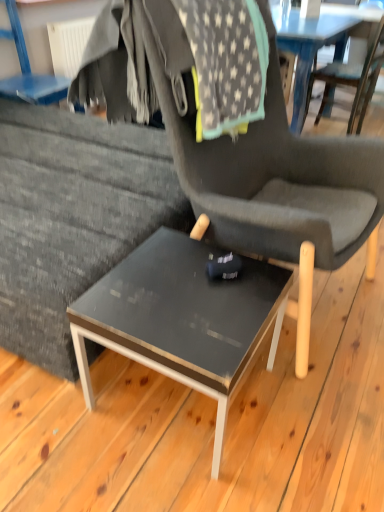
Question: From the image's perspective, is wooden chair at center, which is the 3th chair in left-to-right order, on top of matte black table at center?

Choices:
 (A) no
 (B) yes

Answer: (B)

Question: From a real-world perspective, is wooden chair at center, arranged as the first chair when viewed from the right, physically above matte black table at center?

Choices:
 (A) no
 (B) yes

Answer: (B)

Question: Considering the relative sizes of wooden chair at center, arranged as the first chair when viewed from the right, and matte black table at center in the image provided, is wooden chair at center, arranged as the first chair when viewed from the right, smaller than matte black table at center?

Choices:
 (A) yes
 (B) no

Answer: (B)

Question: From the image's perspective, would you say wooden chair at center, arranged as the first chair when viewed from the right, is shown under matte black table at center?

Choices:
 (A) no
 (B) yes

Answer: (A)

Question: Can you confirm if wooden chair at center, which is the 3th chair in left-to-right order, is wider than matte black table at center?

Choices:
 (A) yes
 (B) no

Answer: (A)

Question: Is matte gray chair at upper left, arranged as the 1th chair when viewed from the left, inside or outside of matte black table at center?

Choices:
 (A) outside
 (B) inside

Answer: (A)

Question: From a real-world perspective, is matte gray chair at upper left, arranged as the third chair when viewed from the right, positioned above or below matte black table at center?

Choices:
 (A) below
 (B) above

Answer: (B)

Question: From the image's perspective, relative to matte black table at center, is matte gray chair at upper left, arranged as the 1th chair when viewed from the left, above or below?

Choices:
 (A) above
 (B) below

Answer: (A)

Question: Relative to matte black table at center, is matte gray chair at upper left, arranged as the 1th chair when viewed from the left, in front or behind?

Choices:
 (A) behind
 (B) front

Answer: (A)

Question: Would you say matte black chair at center, the 2th chair in the right-to-left sequence, is to the left or to the right of wooden chair at center, which is the 3th chair in left-to-right order, in the picture?

Choices:
 (A) right
 (B) left

Answer: (B)

Question: Looking at the image, does matte black chair at center, the 2th chair from the left, seem bigger or smaller compared to wooden chair at center, arranged as the first chair when viewed from the right?

Choices:
 (A) big
 (B) small

Answer: (A)

Question: Considering the positions of matte black chair at center, the 2th chair from the left, and wooden chair at center, which is the 3th chair in left-to-right order, in the image, is matte black chair at center, the 2th chair from the left, taller or shorter than wooden chair at center, which is the 3th chair in left-to-right order,?

Choices:
 (A) short
 (B) tall

Answer: (B)

Question: From the image's perspective, is matte black chair at center, the 2th chair in the right-to-left sequence, positioned above or below wooden chair at center, arranged as the first chair when viewed from the right?

Choices:
 (A) below
 (B) above

Answer: (A)

Question: Considering their positions, is wooden chair at center, which is the 3th chair in left-to-right order, located in front of or behind matte black chair at center, the 2th chair from the left?

Choices:
 (A) behind
 (B) front

Answer: (A)

Question: From the image's perspective, is wooden chair at center, arranged as the first chair when viewed from the right, above or below matte black chair at center, the 2th chair in the right-to-left sequence?

Choices:
 (A) above
 (B) below

Answer: (A)